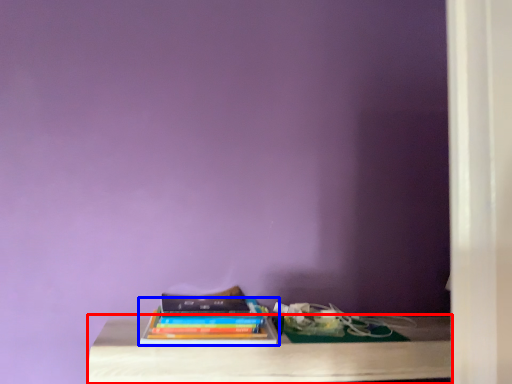
Question: Which object is closer to the camera taking this photo, table (highlighted by a red box) or book (highlighted by a blue box)?

Choices:
 (A) table
 (B) book

Answer: (A)